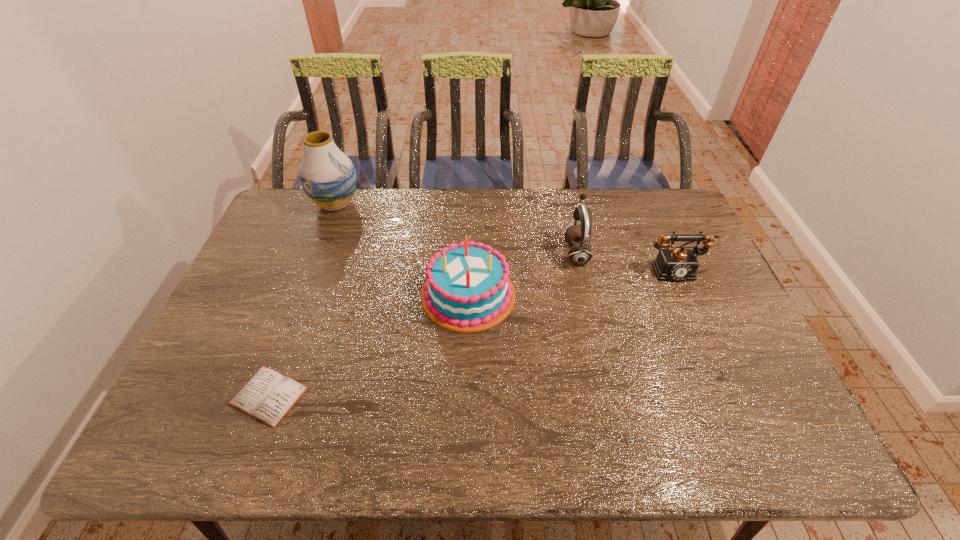
This screenshot has height=540, width=960. What are the coordinates of `empty location between the vase and the second object from right to left` in the screenshot? It's located at (456, 228).

I want to click on free spot between the tallest object and the rightmost object, so click(x=505, y=237).

Locate an element on the screen. vacant space that's between the fourth object from left to right and the third object from left to right is located at coordinates (522, 274).

The height and width of the screenshot is (540, 960). I want to click on free space that is in between the third object from left to right and the rightmost object, so click(571, 282).

Identify the location of free space between the vase and the nearest object. (302, 300).

This screenshot has width=960, height=540. Find the location of `vacant area between the earphone and the farthest object`. vacant area between the earphone and the farthest object is located at coordinates (456, 228).

You are a GUI agent. You are given a task and a screenshot of the screen. Output one action in this format:
    pyautogui.click(x=<x>, y=<y>)
    Task: Click on the vacant point located between the fourth object from left to right and the vase
    This screenshot has height=540, width=960.
    Given the screenshot: What is the action you would take?
    pyautogui.click(x=456, y=228)

Select which object is the third closest to the shortest object. Please provide its 2D coordinates. Your answer should be formatted as a tuple, i.e. [(x, y)], where the tuple contains the x and y coordinates of a point satisfying the conditions above.

[(580, 253)]

Identify the location of object that is the closest to the birthday cake. This screenshot has height=540, width=960. (580, 253).